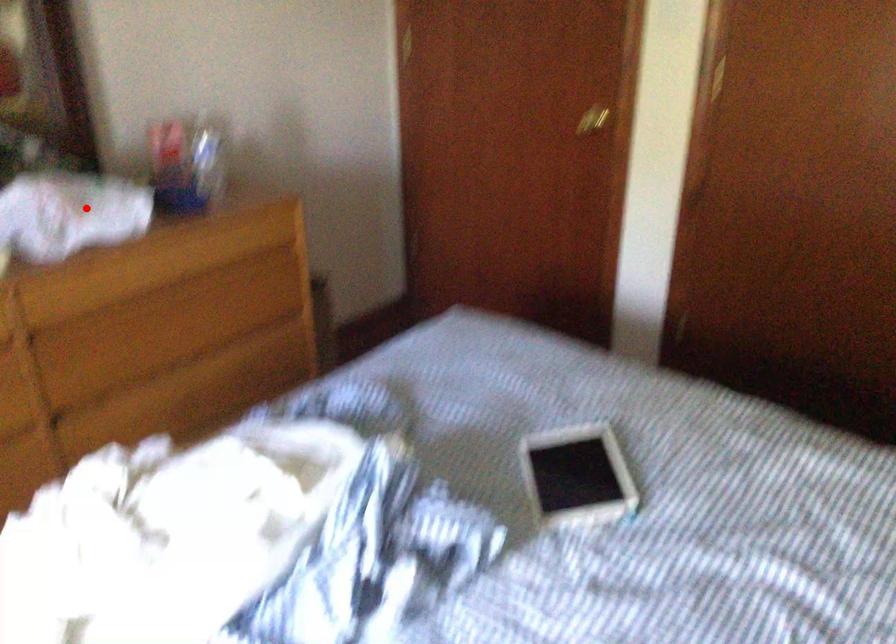
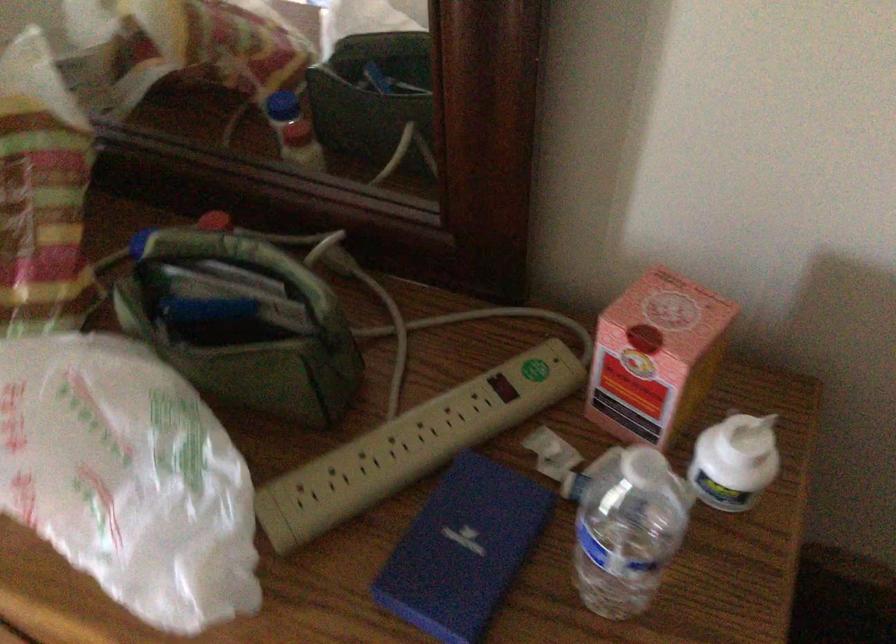
Question: I am providing you with two images of the same scene from different viewpoints. Image1 has a red point marked. In image2, the corresponding 3D location appears at what relative position? Reply with the corresponding letter.

Choices:
 (A) Closer
 (B) Farther

Answer: (A)